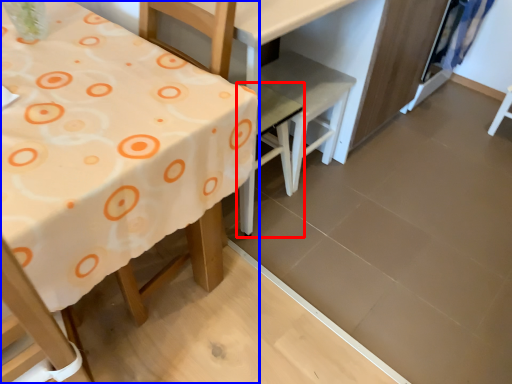
Question: Which object is further to the camera taking this photo, chair (highlighted by a red box) or table (highlighted by a blue box)?

Choices:
 (A) chair
 (B) table

Answer: (A)